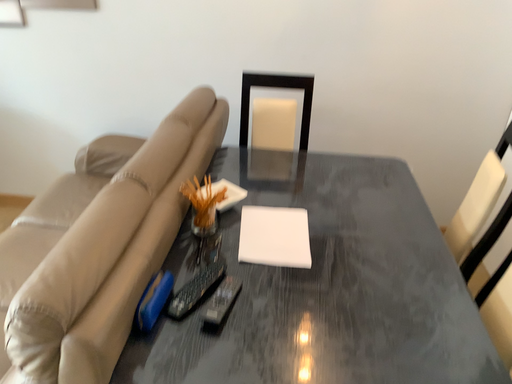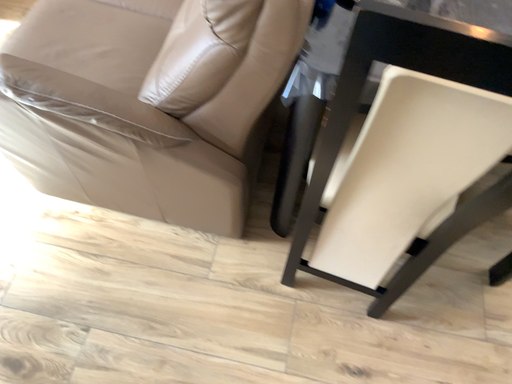
Question: Which way did the camera rotate in the video?

Choices:
 (A) rotated upward
 (B) rotated downward

Answer: (B)